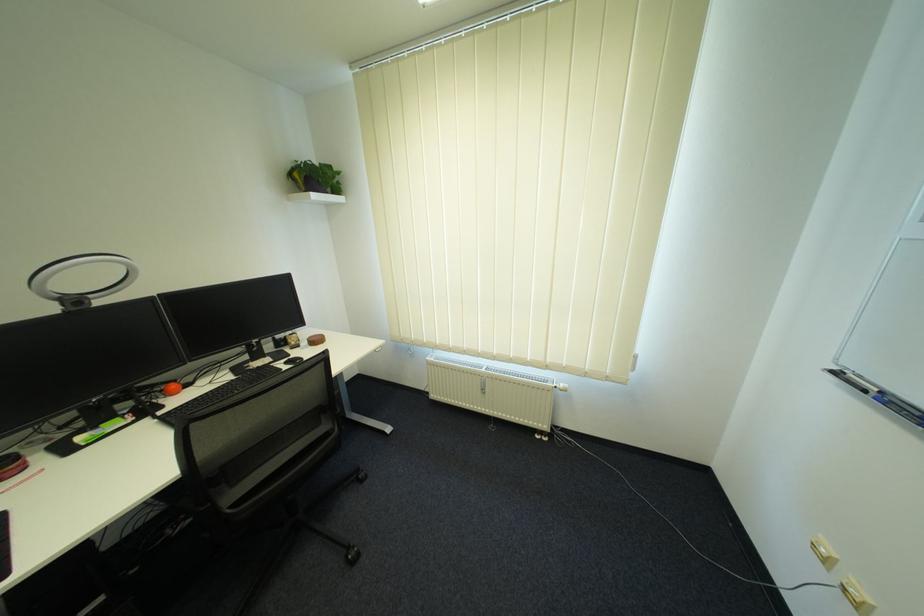
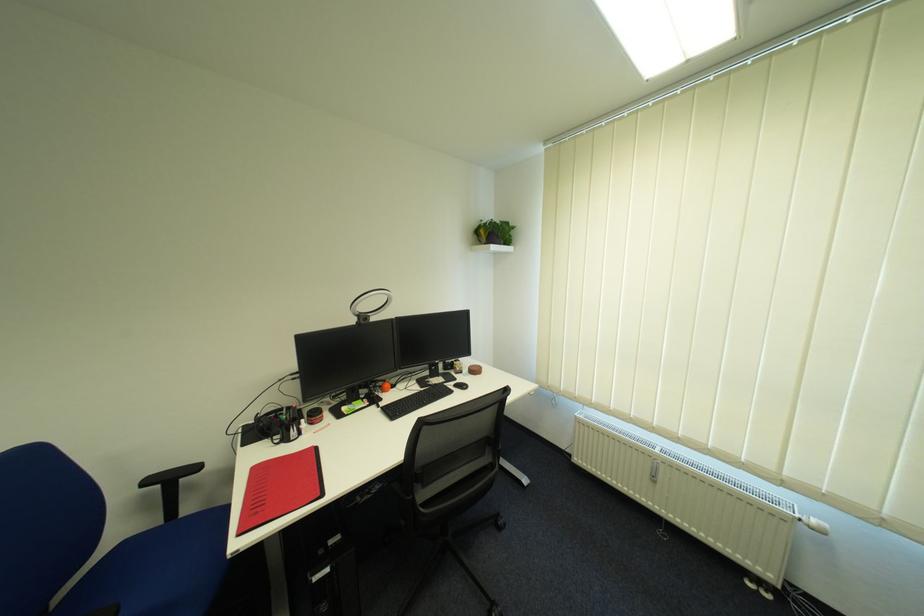
Find the pixel in the second image that matches (x=171, y=392) in the first image.

(390, 387)